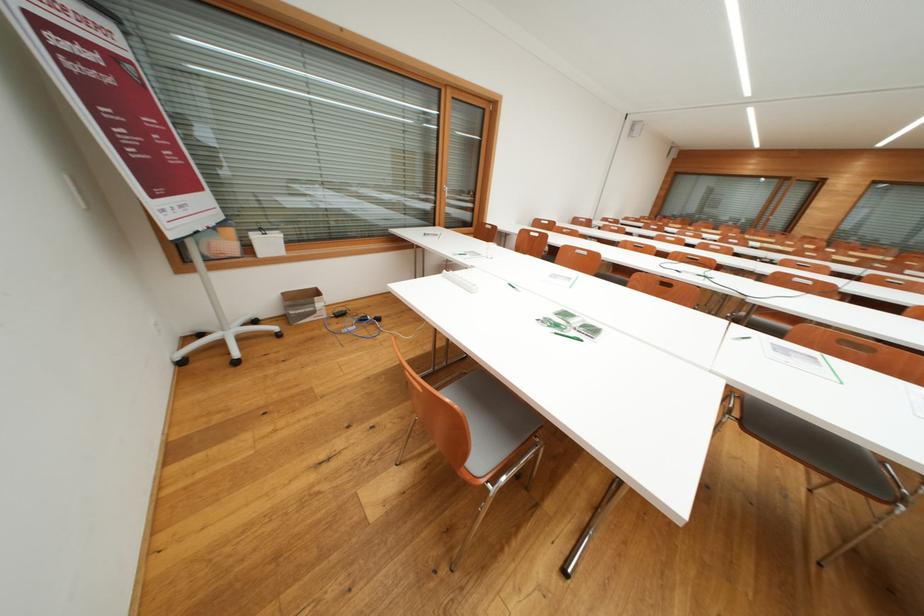
This screenshot has width=924, height=616. I want to click on chair sitting surface, so (x=492, y=410).